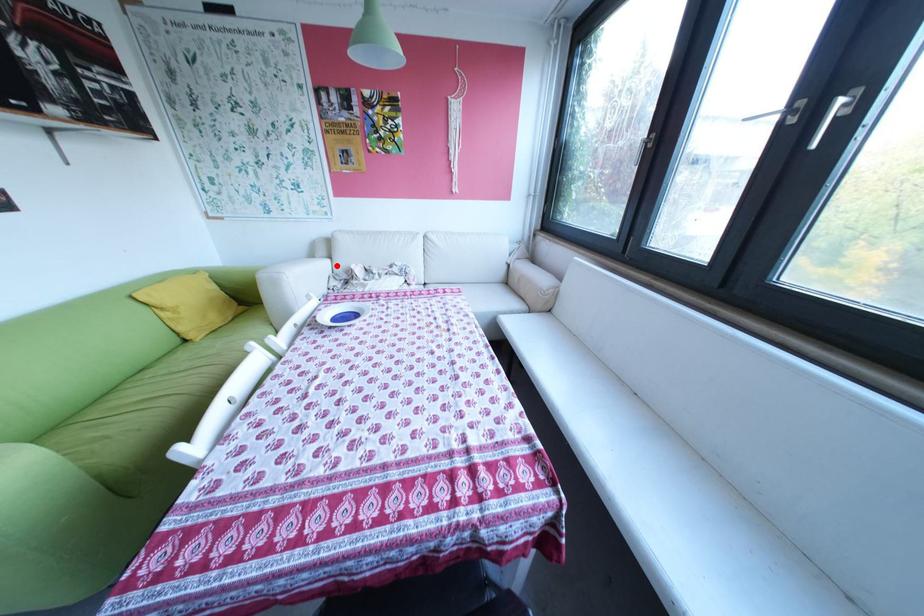
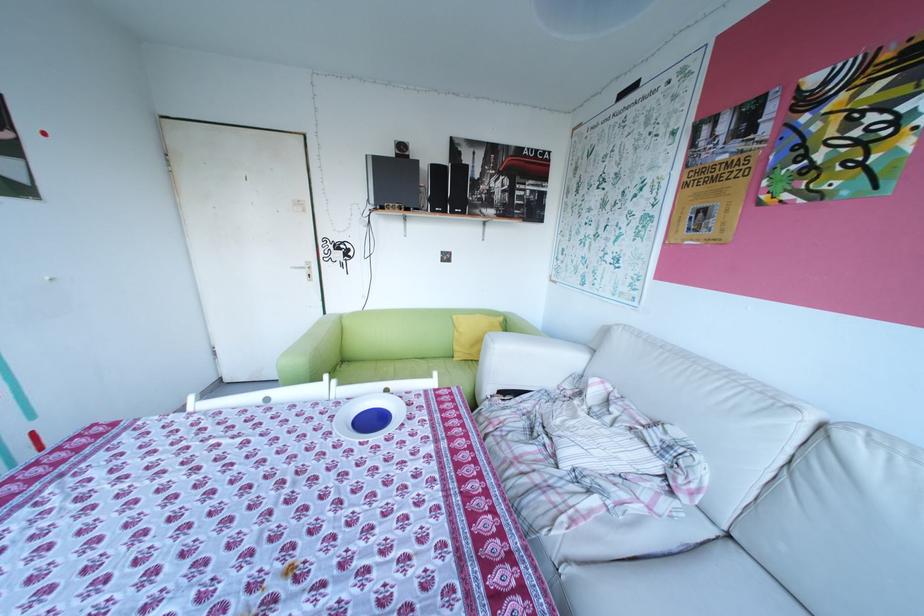
Where in the second image is the point corresponding to the highlighted location from the first image?

(589, 359)